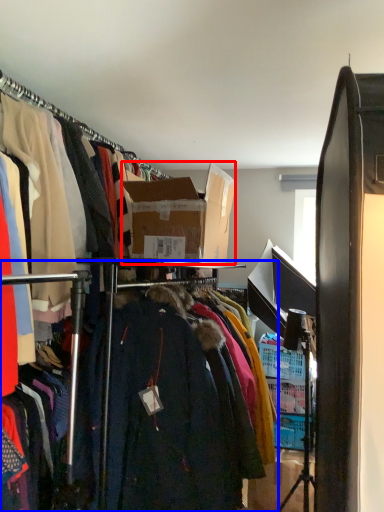
Question: Which object appears farthest to the camera in this image, box (highlighted by a red box) or closet (highlighted by a blue box)?

Choices:
 (A) box
 (B) closet

Answer: (A)